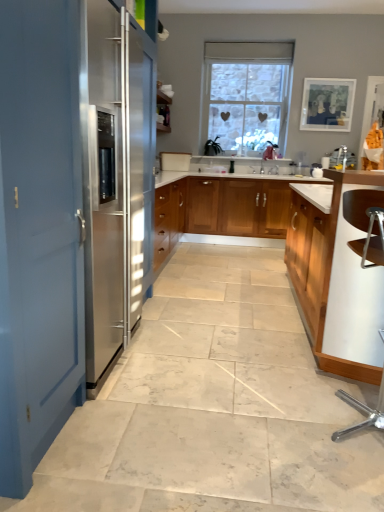
Question: In terms of width, does blue matte door at left look wider or thinner when compared to wooden cabinet at center, which is counted as the second cabinetry, starting from the front?

Choices:
 (A) wide
 (B) thin

Answer: (A)

Question: Is blue matte door at left taller or shorter than wooden cabinet at center, which is counted as the second cabinetry, starting from the front?

Choices:
 (A) tall
 (B) short

Answer: (A)

Question: Which is farther from the light wood/wooden cabinet at right, arranged as the second cabinetry when viewed from the back?

Choices:
 (A) wooden cabinet at center, positioned as the first cabinetry in back-to-front order
 (B) stone textured window at center
 (C) blue matte door at left

Answer: (B)

Question: Estimate the real-world distances between objects in this image. Which object is farther from the stone textured window at center?

Choices:
 (A) wooden cabinet at center, which is counted as the second cabinetry, starting from the front
 (B) blue matte door at left
 (C) light wood/wooden cabinet at right, which ranks as the 1th cabinetry in front-to-back order

Answer: (B)